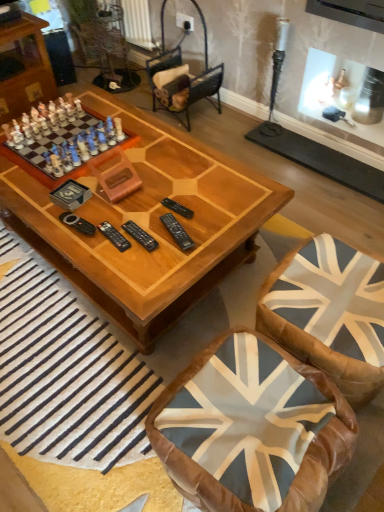
Find the location of a particular element. vacant area that lies between black plastic remote at center and porcelain chess set at left is located at coordinates (122, 192).